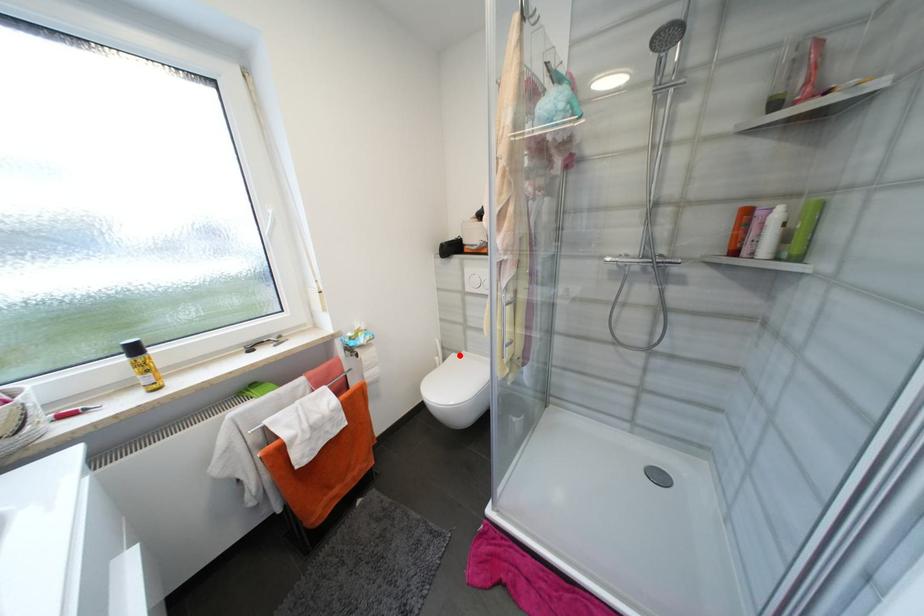
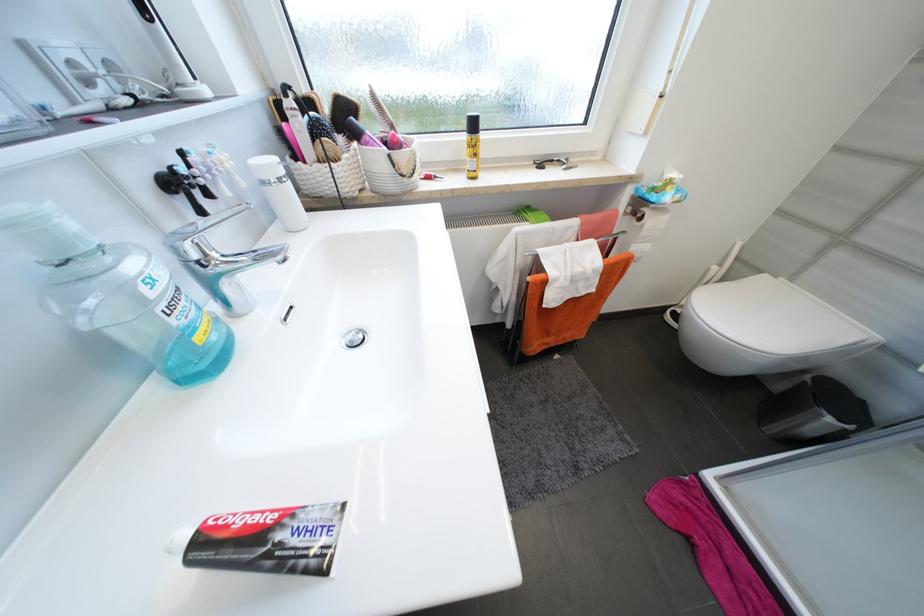
In the second image, find the point that corresponds to the highlighted location in the first image.

(771, 277)